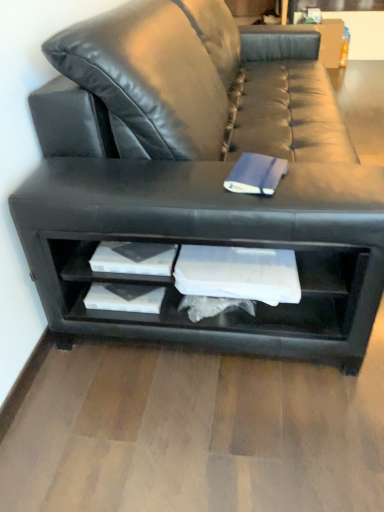
What is the approximate height of black leather shelf at lower center?

black leather shelf at lower center is 12.98 inches in height.

In order to face black leather shelf at lower center, should I rotate leftwards or rightwards?

You should rotate right by 5.133 degrees.

You are a GUI agent. You are given a task and a screenshot of the screen. Output one action in this format:
    pyautogui.click(x=<x>, y=<y>)
    Task: Click on the blue matte paper at center
    The height and width of the screenshot is (512, 384).
    Given the screenshot: What is the action you would take?
    pyautogui.click(x=256, y=174)

Identify the location of black leather shelf at lower center. The width and height of the screenshot is (384, 512). (x=237, y=311).

In the scene shown: From a real-world perspective, is blue matte paper at center physically located above or below black leather couch at center?

Clearly, from a real-world perspective, blue matte paper at center is above black leather couch at center.

How many degrees apart are the facing directions of blue matte paper at center and black leather couch at center?

10.8 degrees.

Is blue matte paper at center to the left or to the right of black leather couch at center in the image?

Clearly, blue matte paper at center is on the left of black leather couch at center in the image.

From the image's perspective, between blue matte paper at center and black leather couch at center, who is located below?

blue matte paper at center appears lower in the image.

Considering the relative sizes of black leather couch at center and blue matte paper at center in the image provided, is black leather couch at center thinner than blue matte paper at center?

In fact, black leather couch at center might be wider than blue matte paper at center.

Does black leather couch at center turn towards blue matte paper at center?

No, black leather couch at center is not oriented towards blue matte paper at center.

Is black leather couch at center next to blue matte paper at center?

No.

What's the angular difference between black leather couch at center and black leather shelf at lower center's facing directions?

The angle between the facing direction of black leather couch at center and the facing direction of black leather shelf at lower center is 0.000232 degrees.

You are a GUI agent. You are given a task and a screenshot of the screen. Output one action in this format:
    pyautogui.click(x=<x>, y=<y>)
    Task: Click on the shelf below the black leather couch at center (from the image's perspective)
    This screenshot has width=384, height=512.
    Given the screenshot: What is the action you would take?
    pyautogui.click(x=237, y=311)

From their relative heights in the image, would you say black leather couch at center is taller or shorter than black leather shelf at lower center?

black leather couch at center is taller than black leather shelf at lower center.

From the image's perspective, does black leather couch at center appear higher than black leather shelf at lower center?

Yes, from the image's perspective, black leather couch at center is on top of black leather shelf at lower center.

Does point (229, 318) lie behind point (246, 170)?

Yes, it is.

Can blue matte paper at center be found inside black leather shelf at lower center?

That's incorrect, blue matte paper at center is not inside black leather shelf at lower center.

Can you tell me how much black leather shelf at lower center and blue matte paper at center differ in facing direction?

There is a 10.8-degree angle between the facing directions of black leather shelf at lower center and blue matte paper at center.

Based on the photo, does black leather shelf at lower center turn towards blue matte paper at center?

No.

Between black leather shelf at lower center and black leather couch at center, which one appears on the right side from the viewer's perspective?

black leather couch at center is more to the right.

Who is shorter, black leather shelf at lower center or black leather couch at center?

black leather shelf at lower center is shorter.

Considering the relative positions of black leather shelf at lower center and black leather couch at center in the image provided, is black leather shelf at lower center in front of black leather couch at center?

No, it is not.

From the image's perspective, is black leather shelf at lower center above or below black leather couch at center?

Based on their image positions, black leather shelf at lower center is located beneath black leather couch at center.

Is blue matte paper at center surrounding black leather shelf at lower center?

No, black leather shelf at lower center is located outside of blue matte paper at center.

I want to click on paperback book located above the black leather shelf at lower center (from the image's perspective), so click(256, 174).

Is blue matte paper at center touching black leather shelf at lower center?

They are not placed beside each other.

From the image's perspective, does blue matte paper at center appear lower than black leather shelf at lower center?

Incorrect, from the image's perspective, blue matte paper at center is higher than black leather shelf at lower center.

Where is `paperback book on the left of black leather couch at center`? This screenshot has width=384, height=512. paperback book on the left of black leather couch at center is located at coordinates (256, 174).

I want to click on paperback book that is below the black leather couch at center (from the image's perspective), so click(256, 174).

From the image, which object appears to be farther from black leather shelf at lower center, black leather couch at center or blue matte paper at center?

blue matte paper at center.

From the image, which object appears to be farther from black leather shelf at lower center, blue matte paper at center or black leather couch at center?

Based on the image, blue matte paper at center appears to be further to black leather shelf at lower center.

Estimate the real-world distances between objects in this image. Which object is closer to blue matte paper at center, black leather couch at center or black leather shelf at lower center?

The object closer to blue matte paper at center is black leather couch at center.

Which object lies nearer to the anchor point black leather couch at center, black leather shelf at lower center or blue matte paper at center?

The object closer to black leather couch at center is black leather shelf at lower center.

From the picture: Considering their positions, is black leather shelf at lower center positioned closer to blue matte paper at center than black leather couch at center?

Among the two, black leather couch at center is located nearer to blue matte paper at center.

Based on their spatial positions, is blue matte paper at center or black leather shelf at lower center further from black leather couch at center?

blue matte paper at center is positioned further to the anchor black leather couch at center.

Where is `paperback book that lies between black leather couch at center and black leather shelf at lower center from top to bottom`? This screenshot has width=384, height=512. paperback book that lies between black leather couch at center and black leather shelf at lower center from top to bottom is located at coordinates (256, 174).